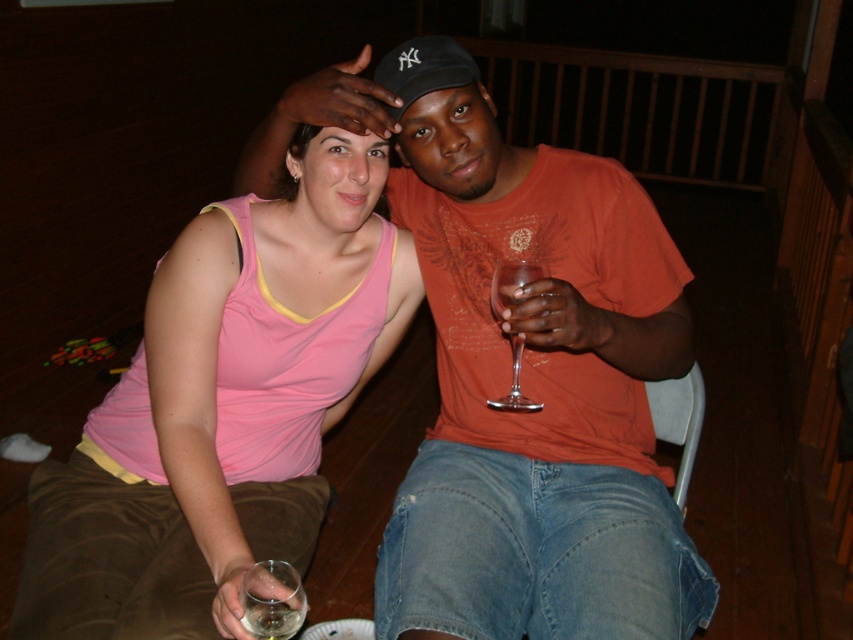
Question: Is matte orange t-shirt at center behind clear glass wine glass at center?

Choices:
 (A) yes
 (B) no

Answer: (B)

Question: Can you confirm if matte orange t-shirt at center is positioned below pink fabric tank top at center?

Choices:
 (A) yes
 (B) no

Answer: (B)

Question: Which is farther from the matte orange t-shirt at center?

Choices:
 (A) clear glass wine glass at center
 (B) clear glass wine glass at lower left
 (C) pink fabric tank top at center

Answer: (B)

Question: Can you confirm if clear glass wine glass at lower left is positioned below clear glass wine glass at center?

Choices:
 (A) no
 (B) yes

Answer: (B)

Question: Which object is closer to the camera taking this photo?

Choices:
 (A) clear glass wine glass at center
 (B) clear glass wine glass at lower left
 (C) pink fabric tank top at center
 (D) matte orange t-shirt at center

Answer: (B)

Question: Which point appears closest to the camera in this image?

Choices:
 (A) (260, 624)
 (B) (196, 497)
 (C) (514, 268)

Answer: (A)